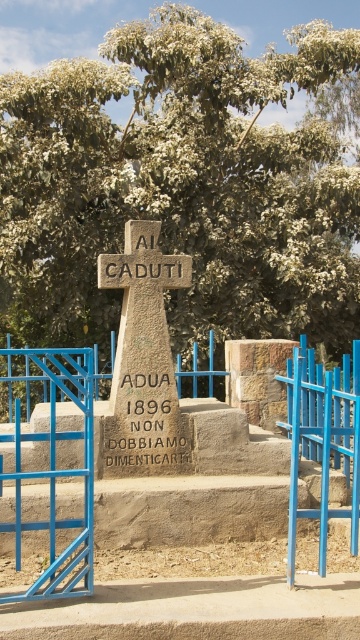
Question: From the image, what is the correct spatial relationship of green leafy tree at center in relation to stone cross at center?

Choices:
 (A) left
 (B) right

Answer: (B)

Question: Which point is farther to the camera?

Choices:
 (A) (x=99, y=456)
 (B) (x=167, y=401)

Answer: (B)

Question: Which of the following is the closest to the observer?

Choices:
 (A) (219, 164)
 (B) (106, 268)
 (C) (191, 404)

Answer: (B)

Question: Can you confirm if green leafy tree at center is thinner than stone cross at center?

Choices:
 (A) yes
 (B) no

Answer: (B)

Question: Can you confirm if brown stone stairs at center is thinner than stone cross at center?

Choices:
 (A) yes
 (B) no

Answer: (B)

Question: Which of the following is the farthest from the observer?

Choices:
 (A) (168, 163)
 (B) (110, 435)
 (C) (95, 451)

Answer: (A)